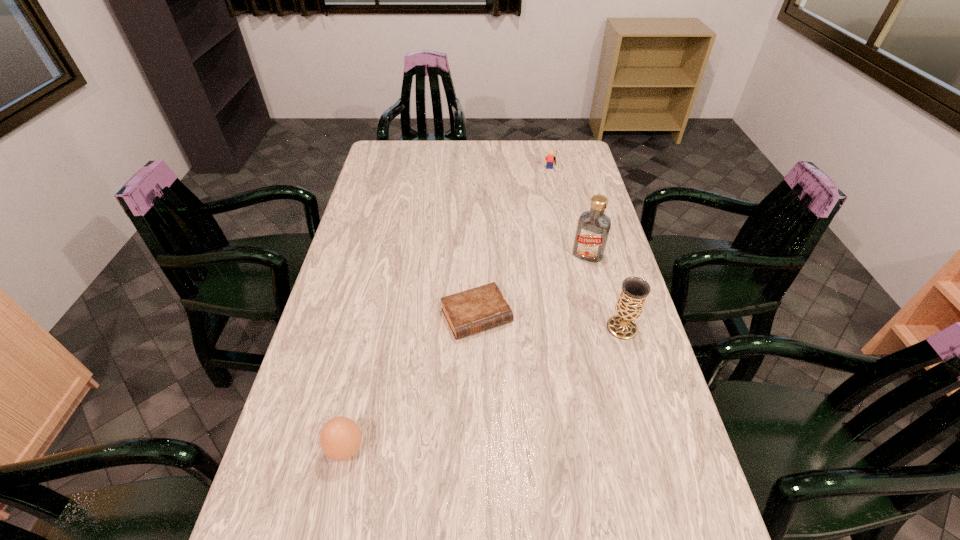
Image resolution: width=960 pixels, height=540 pixels. In order to click on vacant space at the far right corner in this screenshot , I will do `click(577, 159)`.

Where is `free space between the farthest object and the shortest object`? The image size is (960, 540). free space between the farthest object and the shortest object is located at coordinates (514, 244).

This screenshot has height=540, width=960. What are the coordinates of `unoccupied position between the shortest object and the Lego` in the screenshot? It's located at (514, 244).

Identify the location of vacant area that lies between the tallest object and the second object from left to right. (532, 286).

Find the location of `vacant point located between the fourth object from right to left and the chalice`. vacant point located between the fourth object from right to left and the chalice is located at coordinates (549, 322).

You are a GUI agent. You are given a task and a screenshot of the screen. Output one action in this format:
    pyautogui.click(x=<x>, y=<y>)
    Task: Click on the unoccupied position between the farthest object and the fourth object from right to left
    
    Given the screenshot: What is the action you would take?
    pyautogui.click(x=514, y=244)

Locate an element on the screen. This screenshot has width=960, height=540. vacant region between the diary and the nearest object is located at coordinates (411, 383).

Where is `free area in between the farthest object and the second farthest object`? This screenshot has width=960, height=540. free area in between the farthest object and the second farthest object is located at coordinates pyautogui.click(x=568, y=213).

You are a GUI agent. You are given a task and a screenshot of the screen. Output one action in this format:
    pyautogui.click(x=<x>, y=<y>)
    Task: Click on the free space between the farthest object and the shortest object
    
    Given the screenshot: What is the action you would take?
    pyautogui.click(x=514, y=244)

The height and width of the screenshot is (540, 960). I want to click on blank region between the tallest object and the diary, so click(x=532, y=286).